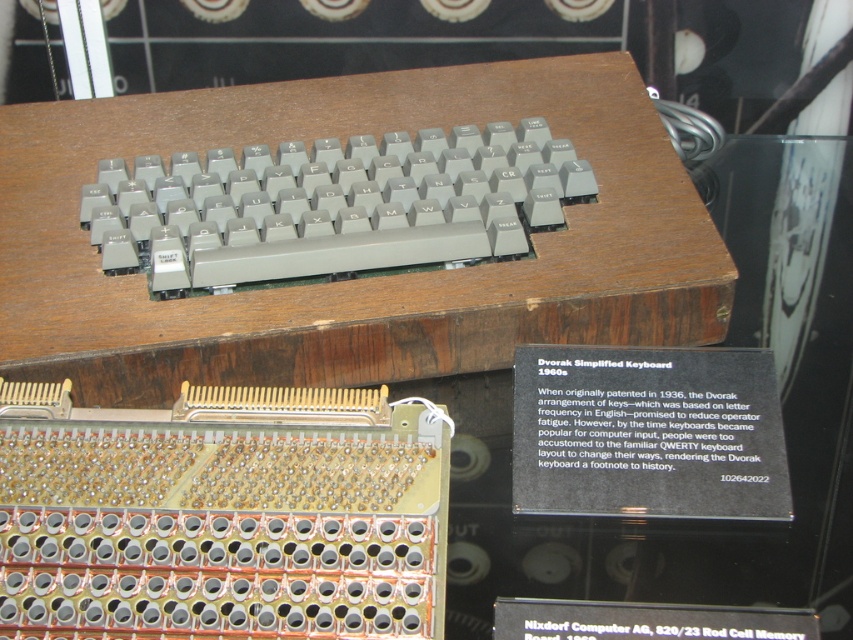
Does wooden table at center appear under gray plastic keyboard at upper center?

Yes.

Who is more forward, (639, 90) or (84, 218)?

Point (84, 218) is more forward.

Does point (300, 128) come behind point (161, 291)?

Yes.

Where is `wooden table at center`? This screenshot has height=640, width=853. wooden table at center is located at coordinates tap(363, 278).